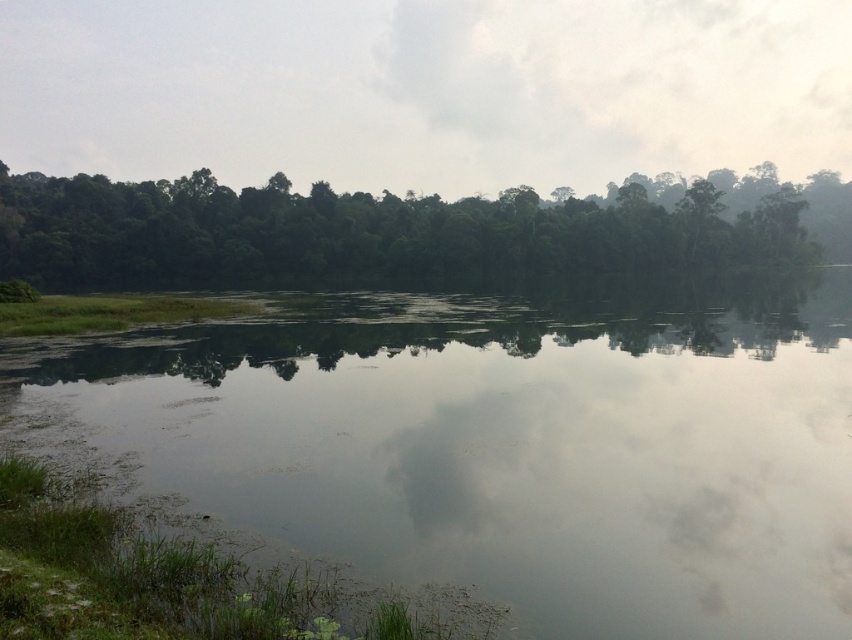
You are standing at the edge of the green grassy river at center and want to walk towards the green leafy trees at upper center. In which direction should you head?

You should head to the right side because the green grassy river at center is positioned on the left side of green leafy trees at upper center, so moving right will take you towards them.

Based on the scene description, which object takes up more area in the image between the green grassy river at center and the green leafy trees at upper center?

The green leafy trees at upper center occupy more space than the green grassy river at center according to the description.